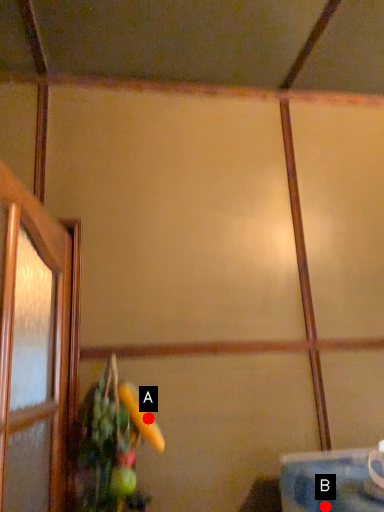
Question: Two points are circled on the image, labeled by A and B beside each circle. Which point is closer to the camera?

Choices:
 (A) A is closer
 (B) B is closer

Answer: (B)